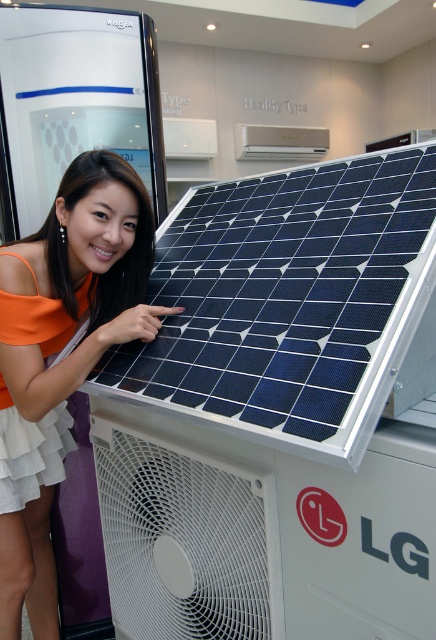
You are an interior designer planning to install a white plastic fan at lower center and a white glossy air conditioner at upper center in a room. Based on the image provided, which object should be placed higher to ensure proper airflow and functionality?

The white glossy air conditioner at upper center should be placed higher than the white plastic fan at lower center because the white plastic fan at lower center is taller than the white glossy air conditioner at upper center, so positioning the air conditioner higher will allow the fan to operate effectively without obstruction.

You are standing 4 feet away from the orange fabric dress at center. Can you reach it without moving your feet?

The orange fabric dress at center is 3.73 feet away from the viewer, so yes, you can reach it without moving your feet since you are standing 4 feet away which is slightly farther than the distance to the dress.